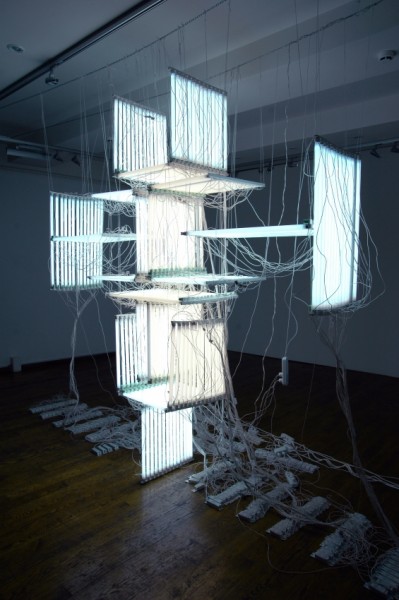
Image resolution: width=399 pixels, height=600 pixels. What are the coordinates of `wall` in the screenshot? It's located at (46, 322).